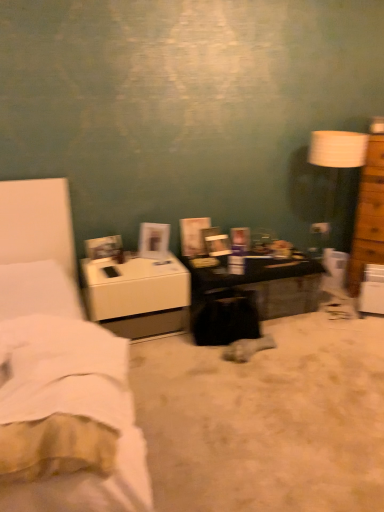
You are a GUI agent. You are given a task and a screenshot of the screen. Output one action in this format:
    pyautogui.click(x=<x>, y=<y>)
    Task: Click on the empty space that is ontop of black fabric bag at center
    This screenshot has height=512, width=384.
    Given the screenshot: What is the action you would take?
    pyautogui.click(x=286, y=370)